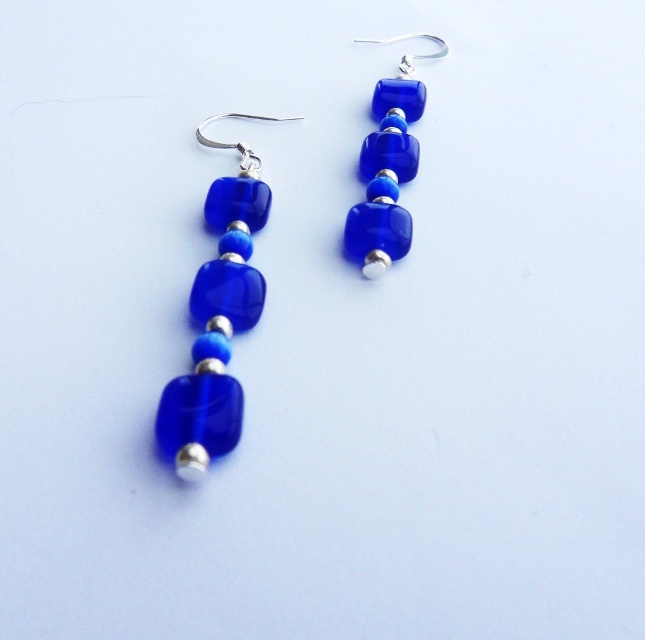
Does cobalt glass bead at left have a greater width compared to cobalt glass cube at center?

No.

Which of these two, cobalt glass bead at left or cobalt glass cube at center, stands shorter?

Standing shorter between the two is cobalt glass cube at center.

Is point (194, 481) positioned in front of point (401, 58)?

Yes, point (194, 481) is closer to viewer.

Locate an element on the screen. This screenshot has width=645, height=640. cobalt glass bead at left is located at coordinates (217, 317).